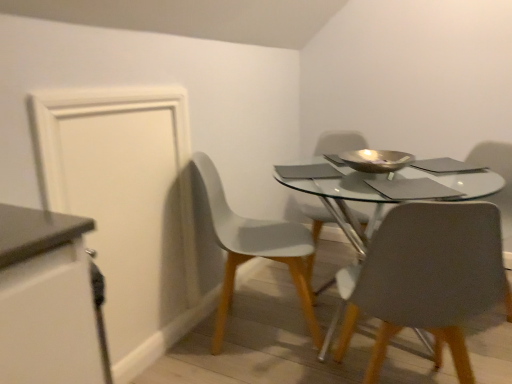
Locate an element on the screen. Image resolution: width=512 pixels, height=384 pixels. vacant point above white matte door at left (from a real-world perspective) is located at coordinates (119, 86).